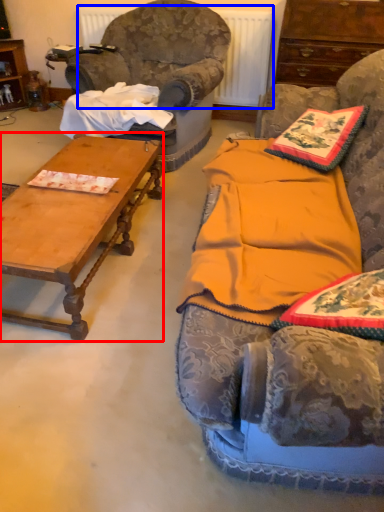
Question: Which object appears closest to the camera in this image, coffee table (highlighted by a red box) or radiator (highlighted by a blue box)?

Choices:
 (A) coffee table
 (B) radiator

Answer: (A)